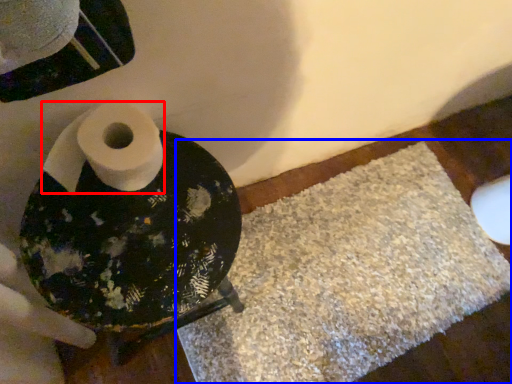
Question: Which object appears farthest to the camera in this image, toilet paper (highlighted by a red box) or bath mat (highlighted by a blue box)?

Choices:
 (A) toilet paper
 (B) bath mat

Answer: (B)